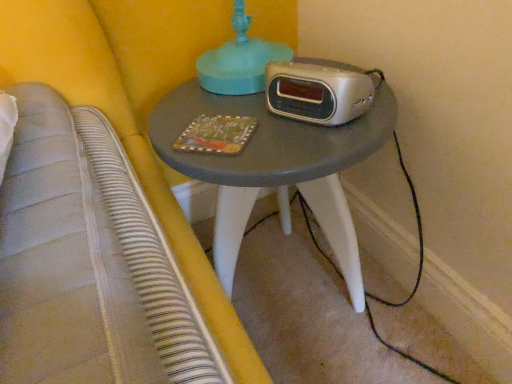
At what (x,y) coordinates should I click in order to perform the action: click on blank space to the left of silver metallic alarm clock at center. Please return your answer as a coordinate pair (x, y). Looking at the image, I should click on (226, 114).